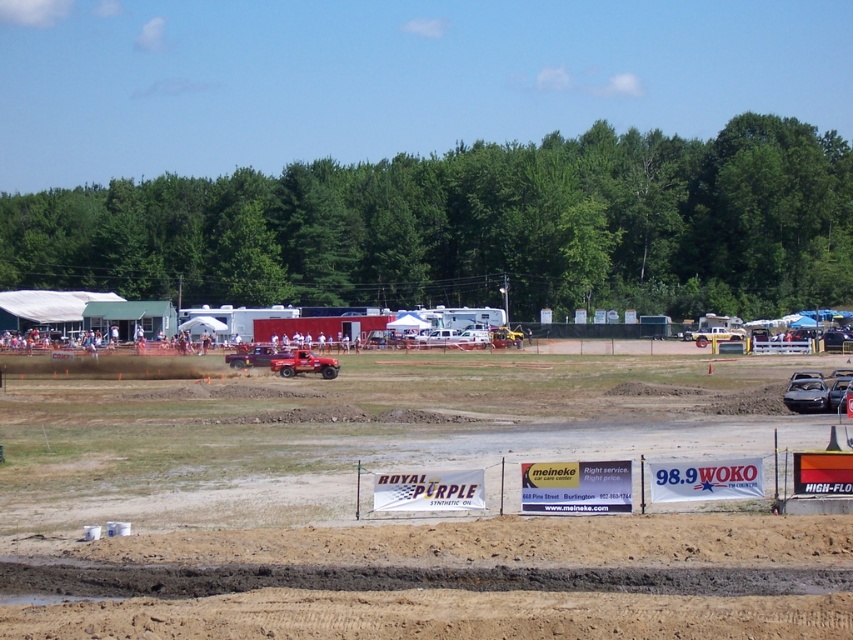
Question: Which object appears closest to the camera in this image?

Choices:
 (A) matte red truck at center
 (B) shiny red truck at center

Answer: (B)

Question: Among these points, which one is farthest from the camera?

Choices:
 (A) (280, 362)
 (B) (242, 365)

Answer: (B)

Question: Is shiny red truck at center thinner than matte red truck at center?

Choices:
 (A) yes
 (B) no

Answer: (A)

Question: Is shiny red truck at center further to the viewer compared to matte red truck at center?

Choices:
 (A) no
 (B) yes

Answer: (A)

Question: Does shiny red truck at center come in front of matte red truck at center?

Choices:
 (A) no
 (B) yes

Answer: (B)